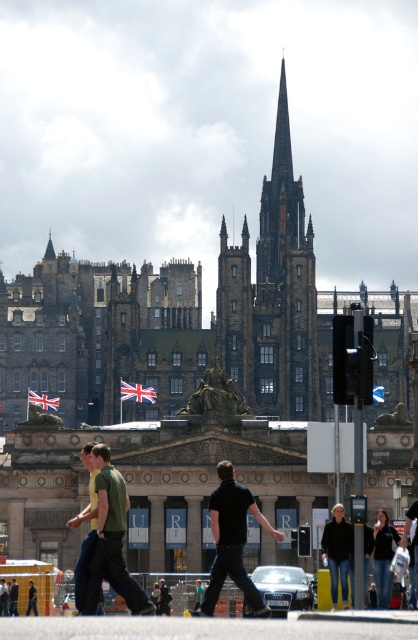
Question: Which of the following is the farthest from the observer?

Choices:
 (A) (382, 596)
 (B) (96, 538)
 (C) (30, 593)
 (D) (221, 474)

Answer: (C)

Question: Is black matte shirt at center wider than green cotton shirt at center?

Choices:
 (A) no
 (B) yes

Answer: (A)

Question: Which point is farther from the camera taking this photo?

Choices:
 (A) (130, 589)
 (B) (209, 611)

Answer: (B)

Question: Which object appears farthest from the camera in this image?

Choices:
 (A) black matte shirt at center
 (B) dark blue jeans at center

Answer: (B)

Question: Does black matte shirt at center have a greater width compared to dark blue jeans at center?

Choices:
 (A) yes
 (B) no

Answer: (A)

Question: Considering the relative positions of black matte shirt at center and dark green shirt at center in the image provided, where is black matte shirt at center located with respect to dark green shirt at center?

Choices:
 (A) left
 (B) right

Answer: (B)